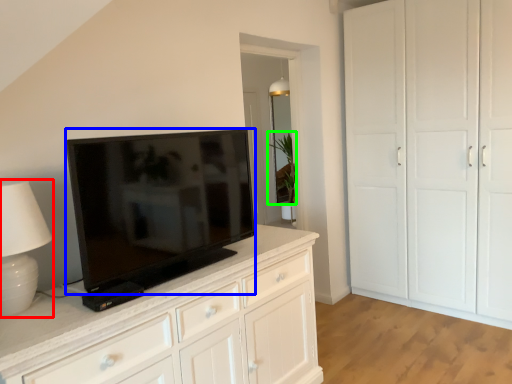
Question: Estimate the real-world distances between objects in this image. Which object is farther from table lamp (highlighted by a red box), television (highlighted by a blue box) or plant (highlighted by a green box)?

Choices:
 (A) television
 (B) plant

Answer: (B)